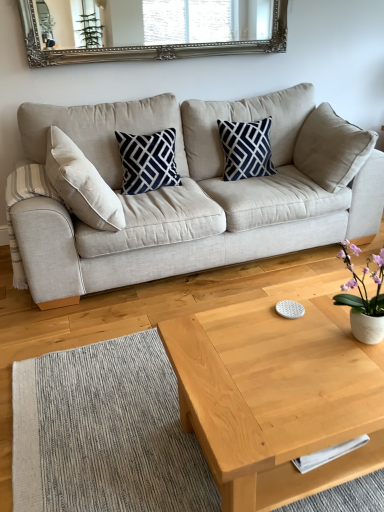
Question: Is light wood/texture coffee table at center not within beige fabric couch at center?

Choices:
 (A) no
 (B) yes

Answer: (B)

Question: Does light wood/texture coffee table at center come behind beige fabric couch at center?

Choices:
 (A) no
 (B) yes

Answer: (A)

Question: Does light wood/texture coffee table at center have a smaller size compared to beige fabric couch at center?

Choices:
 (A) yes
 (B) no

Answer: (A)

Question: Does light wood/texture coffee table at center have a greater width compared to beige fabric couch at center?

Choices:
 (A) yes
 (B) no

Answer: (B)

Question: Is light wood/texture coffee table at center to the right of beige fabric couch at center from the viewer's perspective?

Choices:
 (A) yes
 (B) no

Answer: (A)

Question: Is light wood/texture coffee table at center to the left of beige fabric couch at center from the viewer's perspective?

Choices:
 (A) yes
 (B) no

Answer: (B)

Question: Is beige fabric couch at center inside white ceramic vase at right?

Choices:
 (A) no
 (B) yes

Answer: (A)

Question: Is white ceramic vase at right next to beige fabric couch at center?

Choices:
 (A) no
 (B) yes

Answer: (A)

Question: Is white ceramic vase at right further to the viewer compared to beige fabric couch at center?

Choices:
 (A) yes
 (B) no

Answer: (B)

Question: Is white ceramic vase at right oriented away from beige fabric couch at center?

Choices:
 (A) no
 (B) yes

Answer: (A)

Question: Is white ceramic vase at right in front of beige fabric couch at center?

Choices:
 (A) no
 (B) yes

Answer: (B)

Question: From a real-world perspective, is white ceramic vase at right over beige fabric couch at center?

Choices:
 (A) no
 (B) yes

Answer: (B)

Question: Can light wood/texture coffee table at center be found inside navy blue/white geometric pillow at center, arranged as the 1th pillow when viewed from the left?

Choices:
 (A) no
 (B) yes

Answer: (A)